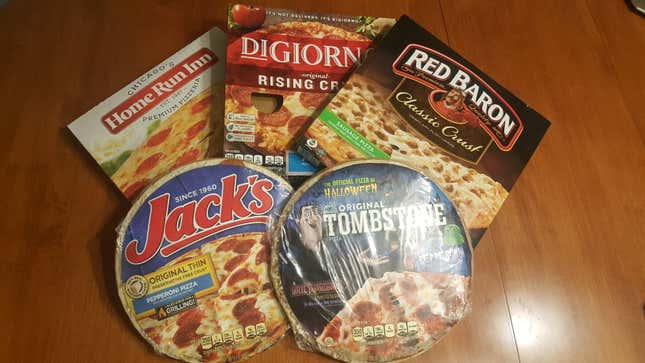
At what (x,y) coordinates should I click in order to perform the action: click on table. Please return your answer as a coordinate pair (x, y). Looking at the image, I should click on (571, 158).